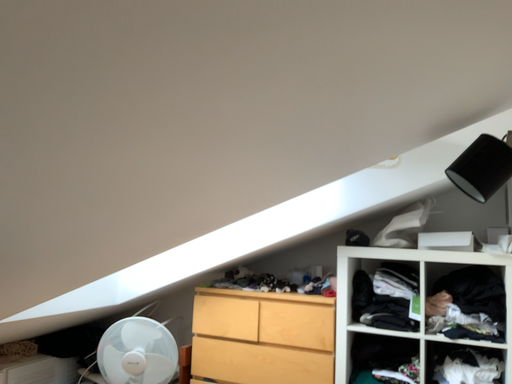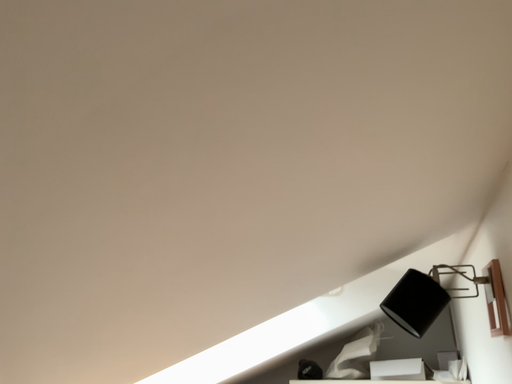
Question: Which way did the camera rotate in the video?

Choices:
 (A) rotated downward
 (B) rotated upward

Answer: (B)